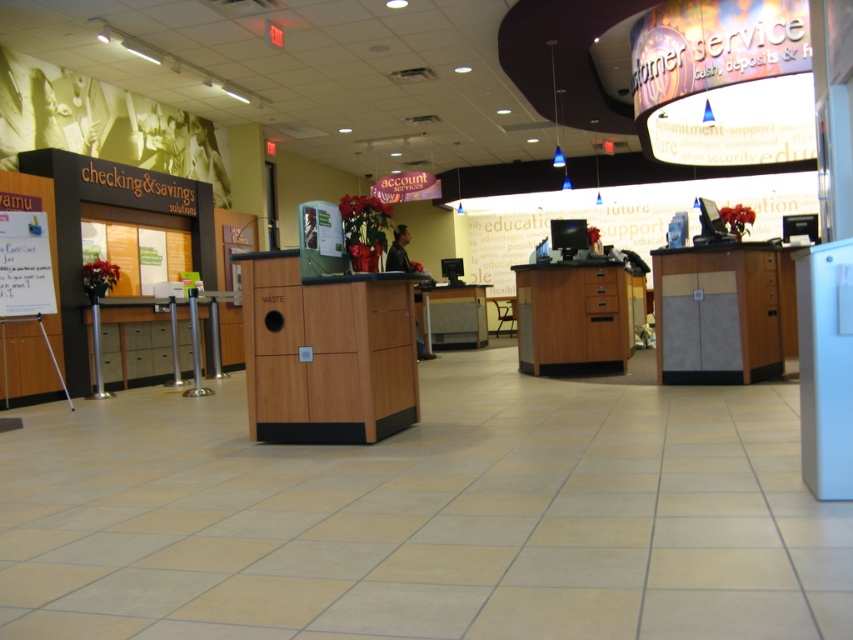
Can you confirm if wooden cabinet at center is positioned below matte wood desk at right?

Yes, wooden cabinet at center is below matte wood desk at right.

Is wooden cabinet at center bigger than matte wood desk at right?

No.

Does point (241, 268) lie in front of point (763, 353)?

Yes.

Find the location of a particular element. The height and width of the screenshot is (640, 853). wooden cabinet at center is located at coordinates click(x=326, y=353).

Is the position of wooden cabinet at center less distant than that of wooden desk at center?

Yes, wooden cabinet at center is in front of wooden desk at center.

Does wooden cabinet at center have a larger size compared to wooden desk at center?

No.

Does point (271, 288) come in front of point (538, 353)?

Yes, it is in front of point (538, 353).

Find the location of a particular element. This screenshot has width=853, height=640. wooden cabinet at center is located at coordinates [x=326, y=353].

Looking at this image, does matte wood desk at right have a greater height compared to wooden desk at center?

Yes, matte wood desk at right is taller than wooden desk at center.

Identify the location of matte wood desk at right. (723, 312).

Is point (705, 294) positioned after point (564, 305)?

No.

Locate an element on the screen. The image size is (853, 640). matte wood desk at right is located at coordinates (723, 312).